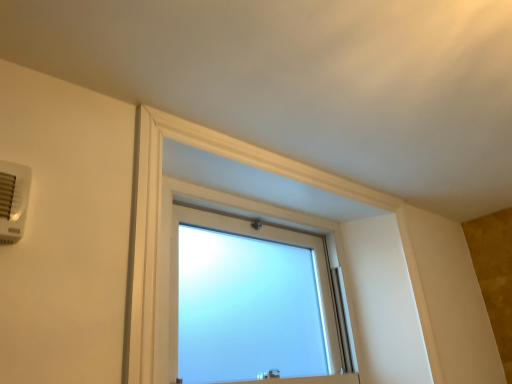
Question: Looking at the image, does white plastic air conditioning unit at upper left seem bigger or smaller compared to frosted glass window at center?

Choices:
 (A) small
 (B) big

Answer: (A)

Question: Do you think white plastic air conditioning unit at upper left is within frosted glass window at center, or outside of it?

Choices:
 (A) inside
 (B) outside

Answer: (B)

Question: Estimate the real-world distances between objects in this image. Which object is closer to the white plastic air conditioning unit at upper left?

Choices:
 (A) frosted glass window at center
 (B) frosted glass window at upper center

Answer: (B)

Question: Estimate the real-world distances between objects in this image. Which object is closer to the frosted glass window at upper center?

Choices:
 (A) frosted glass window at center
 (B) white plastic air conditioning unit at upper left

Answer: (A)